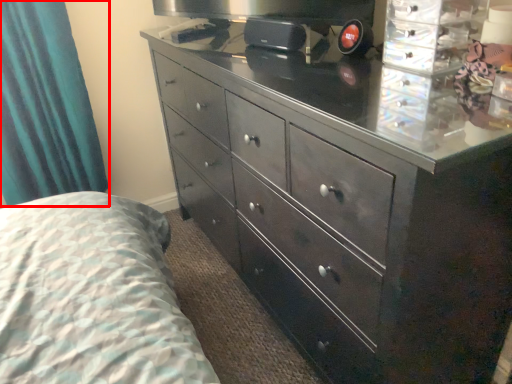
Question: From the image's perspective, what is the correct spatial positioning of curtain (annotated by the red box) in reference to chest of drawers?

Choices:
 (A) above
 (B) below

Answer: (A)